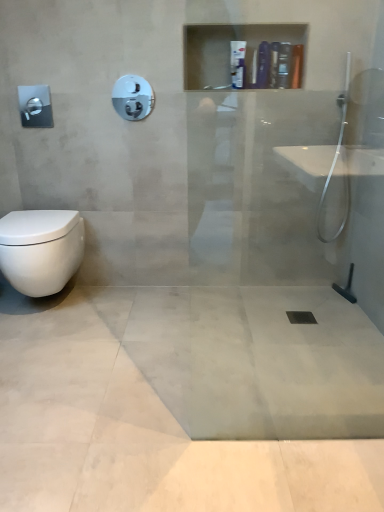
Question: From the image's perspective, does matte black soap dispenser at upper center, arranged as the 4th toiletry when viewed from the left, appear higher than silver metallic towel bar at upper left, which is counted as the first towel bar, starting from the bottom?

Choices:
 (A) no
 (B) yes

Answer: (B)

Question: Would you say matte black soap dispenser at upper center, arranged as the 4th toiletry when viewed from the left, contains silver metallic towel bar at upper left, placed as the 2th towel bar when sorted from right to left?

Choices:
 (A) no
 (B) yes

Answer: (A)

Question: Can you confirm if matte black soap dispenser at upper center, arranged as the 4th toiletry when viewed from the left, is positioned to the right of silver metallic towel bar at upper left, which is counted as the first towel bar, starting from the bottom?

Choices:
 (A) no
 (B) yes

Answer: (B)

Question: Is matte black soap dispenser at upper center, arranged as the 4th toiletry when viewed from the left, next to silver metallic towel bar at upper left, which is the second towel bar from top to bottom, and touching it?

Choices:
 (A) no
 (B) yes

Answer: (A)

Question: Is matte black soap dispenser at upper center, which ranks as the second toiletry in right-to-left order, shorter than silver metallic towel bar at upper left, the 1th towel bar when ordered from left to right?

Choices:
 (A) no
 (B) yes

Answer: (B)

Question: Considering the relative sizes of matte black soap dispenser at upper center, which ranks as the second toiletry in right-to-left order, and silver metallic towel bar at upper left, the 1th towel bar when ordered from left to right, in the image provided, is matte black soap dispenser at upper center, which ranks as the second toiletry in right-to-left order, smaller than silver metallic towel bar at upper left, the 1th towel bar when ordered from left to right,?

Choices:
 (A) yes
 (B) no

Answer: (B)

Question: Is the position of matte black soap dispenser at upper center, which ranks as the second toiletry in right-to-left order, less distant than that of white glossy towel bar at upper center, which appears as the 2th towel bar when viewed from the left?

Choices:
 (A) no
 (B) yes

Answer: (B)

Question: Does matte black soap dispenser at upper center, which ranks as the second toiletry in right-to-left order, have a larger size compared to white glossy towel bar at upper center, which is counted as the first towel bar, starting from the right?

Choices:
 (A) yes
 (B) no

Answer: (A)

Question: Can you confirm if matte black soap dispenser at upper center, which ranks as the second toiletry in right-to-left order, is taller than white glossy towel bar at upper center, which appears as the 2th towel bar when ordered from the bottom?

Choices:
 (A) no
 (B) yes

Answer: (B)

Question: Considering the relative sizes of matte black soap dispenser at upper center, arranged as the 4th toiletry when viewed from the left, and white glossy towel bar at upper center, which appears as the 2th towel bar when ordered from the bottom, in the image provided, is matte black soap dispenser at upper center, arranged as the 4th toiletry when viewed from the left, wider than white glossy towel bar at upper center, which appears as the 2th towel bar when ordered from the bottom,?

Choices:
 (A) no
 (B) yes

Answer: (A)

Question: Is matte black soap dispenser at upper center, which ranks as the second toiletry in right-to-left order, to the right of white glossy towel bar at upper center, which appears as the 2th towel bar when viewed from the left, from the viewer's perspective?

Choices:
 (A) yes
 (B) no

Answer: (A)

Question: Is matte black soap dispenser at upper center, arranged as the 4th toiletry when viewed from the left, outside white glossy towel bar at upper center, which is counted as the first towel bar, starting from the right?

Choices:
 (A) yes
 (B) no

Answer: (A)

Question: Is satin nickel showerhead at upper left thinner than white glossy bottle at upper center, which is counted as the 2th toiletry, starting from the left?

Choices:
 (A) yes
 (B) no

Answer: (A)